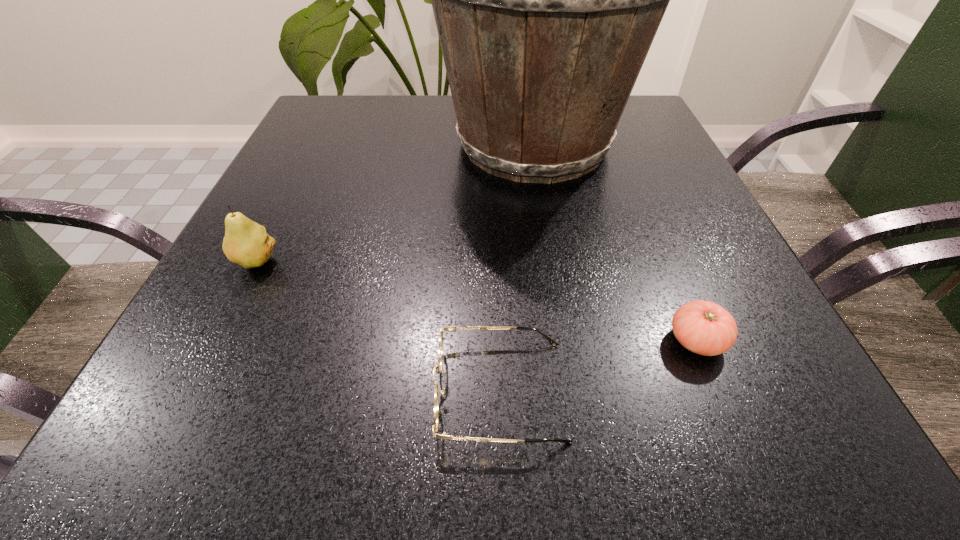
Locate an element on the screen. free space that is in between the tomato and the tallest object is located at coordinates (615, 242).

Image resolution: width=960 pixels, height=540 pixels. I want to click on free area in between the bucket and the tomato, so click(x=615, y=242).

Image resolution: width=960 pixels, height=540 pixels. What are the coordinates of `vacant region between the tallest object and the tomato` in the screenshot? It's located at (615, 242).

Where is `vacant area that lies between the pear and the spectacles`? The height and width of the screenshot is (540, 960). vacant area that lies between the pear and the spectacles is located at coordinates (378, 326).

Locate an element on the screen. vacant area that lies between the pear and the tomato is located at coordinates (476, 301).

This screenshot has width=960, height=540. I want to click on object that stands as the second closest to the spectacles, so click(x=246, y=243).

Where is `object that stands as the closest to the pear`? The width and height of the screenshot is (960, 540). object that stands as the closest to the pear is located at coordinates coord(546,0).

At what (x,y) coordinates should I click in order to perform the action: click on vacant position in the image that satisfies the following two spatial constraints: 1. on the back side of the second tallest object; 2. on the left side of the farthest object. Please return your answer as a coordinate pair (x, y). Looking at the image, I should click on (316, 144).

Image resolution: width=960 pixels, height=540 pixels. I want to click on free spot that satisfies the following two spatial constraints: 1. on the front side of the tomato; 2. on the lenses of the spectacles, so (x=717, y=390).